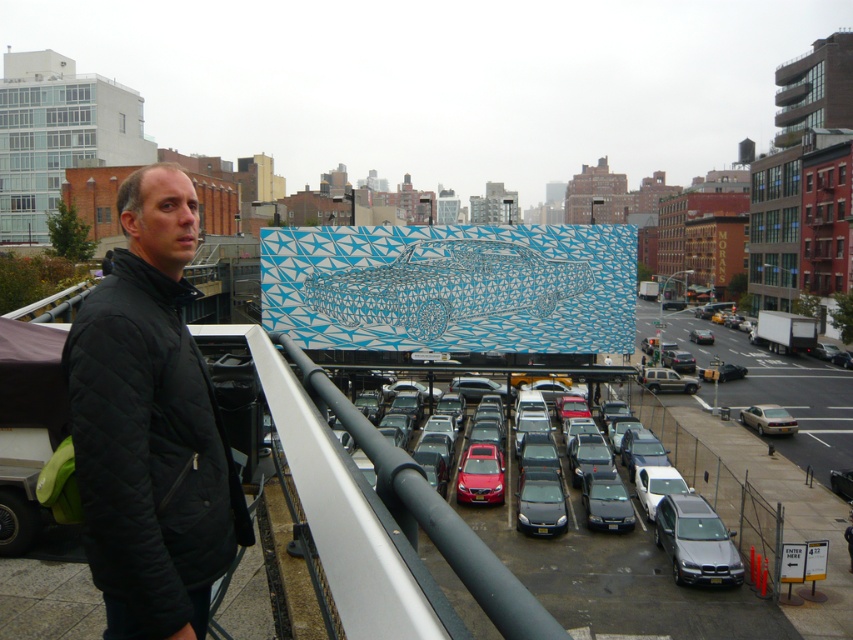
Does satin silver sedan at lower right have a greater width compared to silver metallic sedan at center?

Yes, satin silver sedan at lower right is wider than silver metallic sedan at center.

Is satin silver sedan at lower right taller than silver metallic sedan at center?

Correct, satin silver sedan at lower right is much taller as silver metallic sedan at center.

Is point (660, 508) positioned before point (786, 413)?

That is True.

Where is `satin silver sedan at lower right`? The height and width of the screenshot is (640, 853). satin silver sedan at lower right is located at coordinates click(x=695, y=541).

Is satin black sedan at center smaller than silver metallic suv at center?

Incorrect, satin black sedan at center is not smaller in size than silver metallic suv at center.

What are the coordinates of `satin black sedan at center` in the screenshot? It's located at (540, 502).

You are a GUI agent. You are given a task and a screenshot of the screen. Output one action in this format:
    pyautogui.click(x=<x>, y=<y>)
    Task: Click on the satin black sedan at center
    This screenshot has height=640, width=853.
    Given the screenshot: What is the action you would take?
    pyautogui.click(x=540, y=502)

I want to click on satin black sedan at center, so click(540, 502).

Can you confirm if satin silver sedan at lower right is bigger than silver metallic suv at center?

Correct, satin silver sedan at lower right is larger in size than silver metallic suv at center.

What do you see at coordinates (695, 541) in the screenshot? The image size is (853, 640). I see `satin silver sedan at lower right` at bounding box center [695, 541].

Does point (689, 531) come behind point (671, 378)?

No, it is not.

The width and height of the screenshot is (853, 640). What are the coordinates of `satin silver sedan at lower right` in the screenshot? It's located at (695, 541).